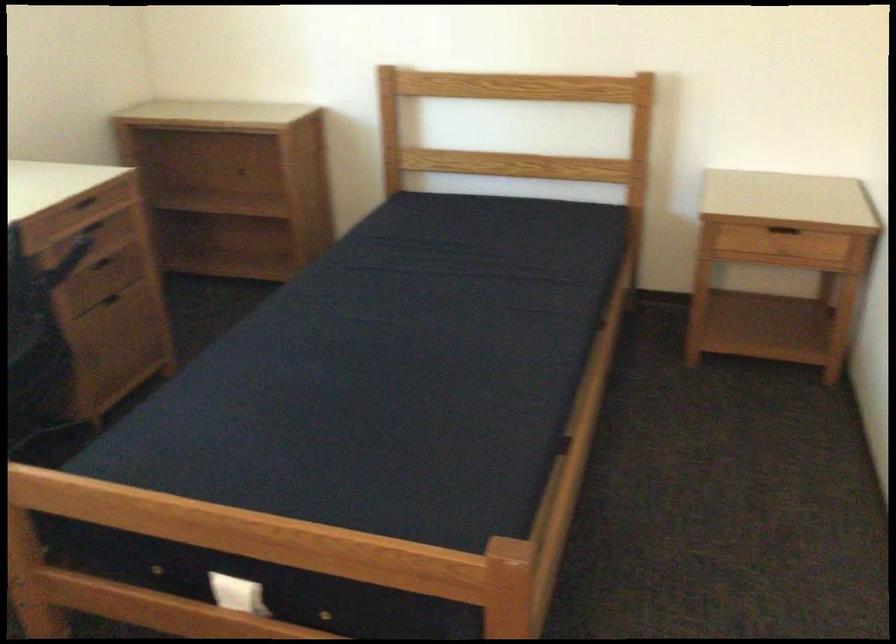
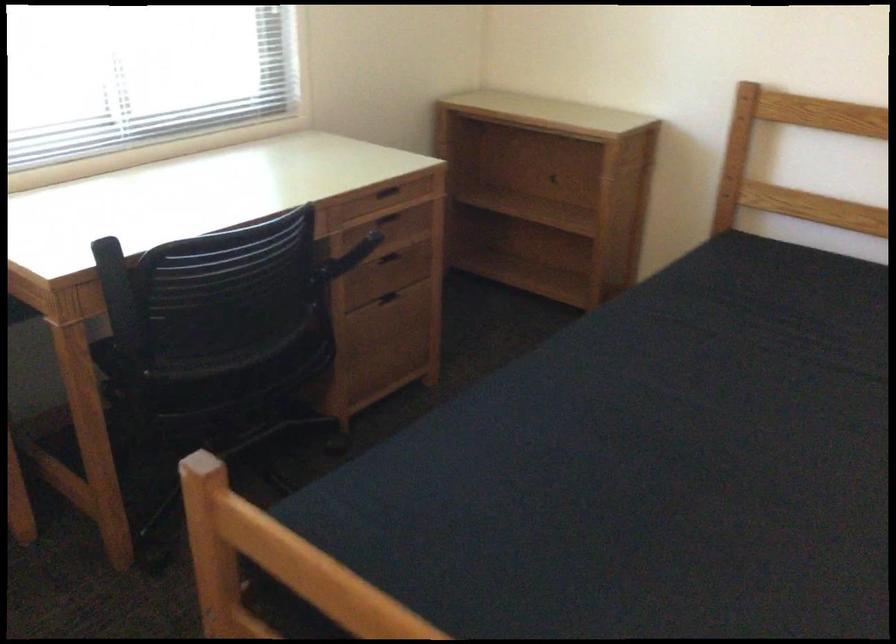
Question: The camera is either moving clockwise (left) or counter-clockwise (right) around the object. The first image is from the beginning of the video and the second image is from the end. Is the camera moving left or right when shooting the video?

Choices:
 (A) Left
 (B) Right

Answer: (B)